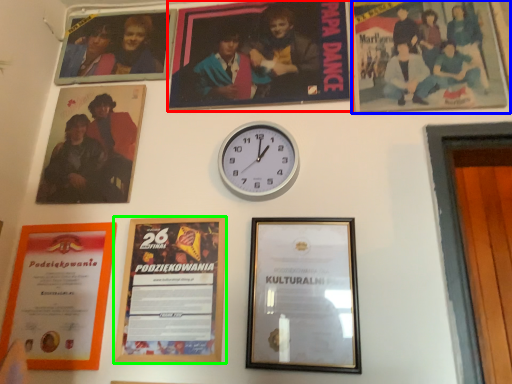
Question: Based on their relative distances, which object is farther from picture frame (highlighted by a red box)? Choose from picture frame (highlighted by a blue box) and picture frame (highlighted by a green box).

Choices:
 (A) picture frame
 (B) picture frame

Answer: (B)